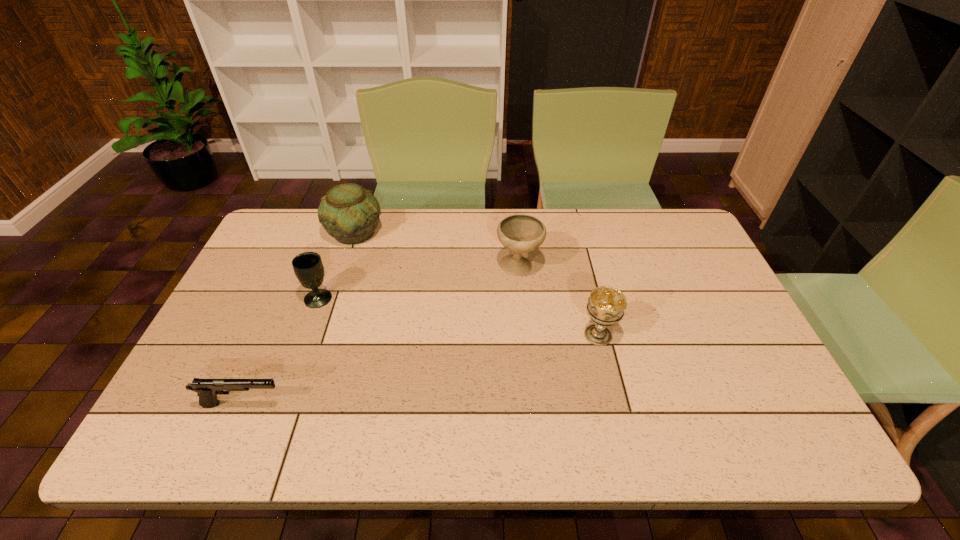
You are a GUI agent. You are given a task and a screenshot of the screen. Output one action in this format:
    pyautogui.click(x=<x>, y=<y>)
    Task: Click on the farthest object
    
    Given the screenshot: What is the action you would take?
    349,213

The image size is (960, 540). What are the coordinates of `the second object from right to left` in the screenshot? It's located at (519, 233).

Identify the location of the second chalice from right to left. (519, 233).

Where is `the leftmost chalice`? The width and height of the screenshot is (960, 540). the leftmost chalice is located at coordinates (308, 267).

Locate an element on the screen. Image resolution: width=960 pixels, height=540 pixels. the second nearest chalice is located at coordinates (308, 267).

Where is `the rightmost chalice`? This screenshot has height=540, width=960. the rightmost chalice is located at coordinates (606, 305).

Locate an element on the screen. the nearest chalice is located at coordinates (606, 305).

You are a GUI agent. You are given a task and a screenshot of the screen. Output one action in this format:
    pyautogui.click(x=<x>, y=<y>)
    Task: Click on the nearest object
    
    Given the screenshot: What is the action you would take?
    pyautogui.click(x=207, y=389)

In order to click on the shortest object in this screenshot , I will do `click(207, 389)`.

Identify the location of vacant space located on the front of the pottery. (323, 329).